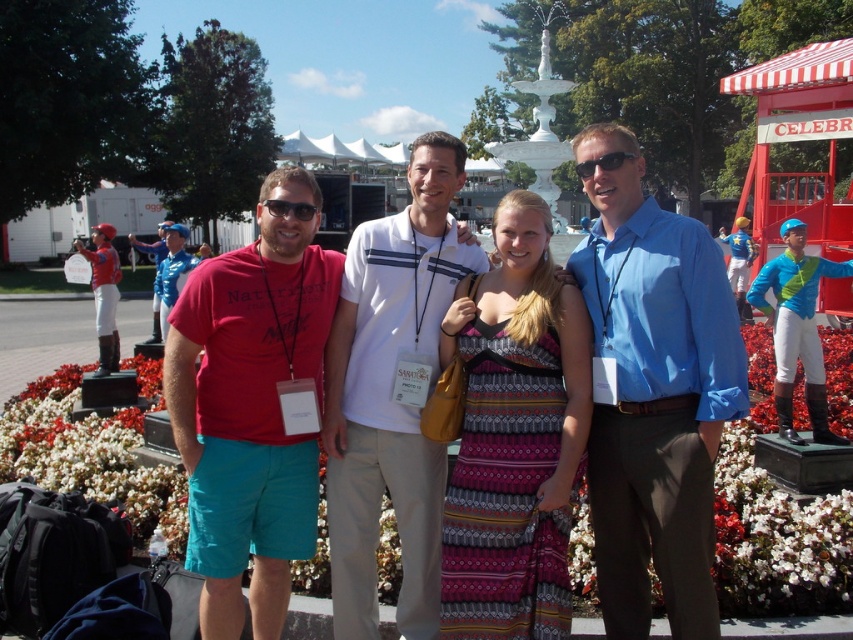
What do you see at coordinates (653, 392) in the screenshot? The image size is (853, 640). I see `blue cotton shirt at center` at bounding box center [653, 392].

Does blue cotton shirt at center have a lesser width compared to patterned fabric dress at center?

Incorrect, blue cotton shirt at center's width is not less than patterned fabric dress at center's.

Is point (659, 403) less distant than point (537, 577)?

Yes, point (659, 403) is closer to viewer.

You are a GUI agent. You are given a task and a screenshot of the screen. Output one action in this format:
    pyautogui.click(x=<x>, y=<y>)
    Task: Click on the blue cotton shirt at center
    This screenshot has height=640, width=853.
    Given the screenshot: What is the action you would take?
    pyautogui.click(x=653, y=392)

Is matte red t-shirt at center smaller than patterned fabric dress at center?

Incorrect, matte red t-shirt at center is not smaller in size than patterned fabric dress at center.

This screenshot has height=640, width=853. What do you see at coordinates (252, 404) in the screenshot?
I see `matte red t-shirt at center` at bounding box center [252, 404].

Image resolution: width=853 pixels, height=640 pixels. What do you see at coordinates (252, 404) in the screenshot?
I see `matte red t-shirt at center` at bounding box center [252, 404].

Locate an element on the screen. The height and width of the screenshot is (640, 853). matte red t-shirt at center is located at coordinates (252, 404).

Does blue cotton shirt at center have a larger size compared to matte red t-shirt at center?

Yes, blue cotton shirt at center is bigger than matte red t-shirt at center.

Is point (714, 358) more distant than point (277, 348)?

No, it is not.

Between point (685, 566) and point (329, 252), which one is positioned in front?

Positioned in front is point (685, 566).

Locate an element on the screen. blue cotton shirt at center is located at coordinates (653, 392).